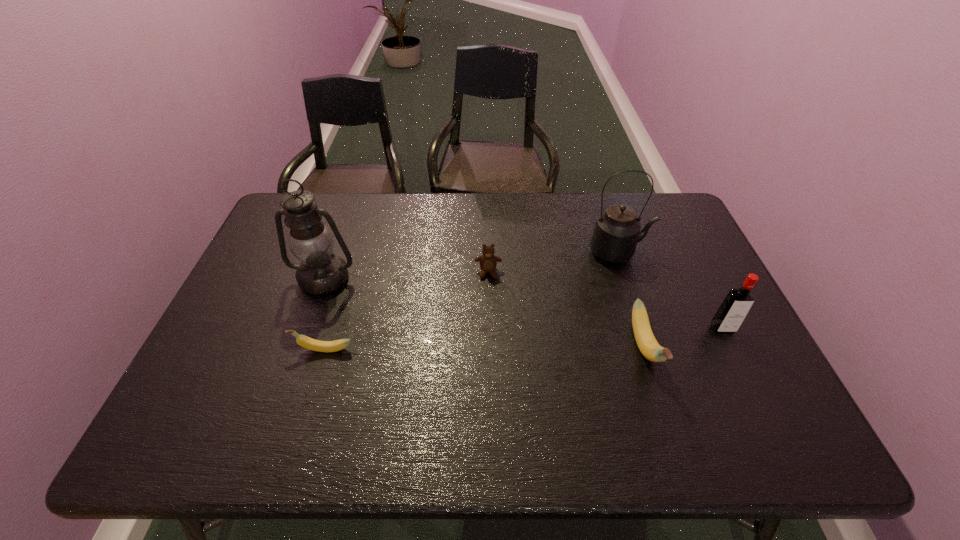
Locate an element on the screen. This screenshot has height=540, width=960. vacant region located at the stem of the left banana is located at coordinates (x=226, y=349).

Find the location of `free space located 0.220m at the stem of the left banana`. free space located 0.220m at the stem of the left banana is located at coordinates (206, 349).

Locate an element on the screen. free spot located at the stem of the right banana is located at coordinates (663, 406).

In order to click on free space located 0.050m on the front of the oil lamp in this screenshot , I will do `click(313, 310)`.

You are a GUI agent. You are given a task and a screenshot of the screen. Output one action in this format:
    pyautogui.click(x=<x>, y=<y>)
    Task: Click on the vacant space located spout on the kettle
    This screenshot has height=540, width=960.
    Given the screenshot: What is the action you would take?
    pyautogui.click(x=699, y=252)

Find the location of a particular element. The image size is (960, 540). vacant space located on the front and back of the vodka is located at coordinates (749, 383).

Find the location of `free point located 0.190m at the face of the teddy bear`. free point located 0.190m at the face of the teddy bear is located at coordinates (490, 332).

Identify the location of object situated at the near edge. This screenshot has height=540, width=960. (649, 347).

The height and width of the screenshot is (540, 960). Find the location of `object that is at the left edge`. object that is at the left edge is located at coordinates (321, 272).

Where is `kettle that is positioned at the right edge`? The width and height of the screenshot is (960, 540). kettle that is positioned at the right edge is located at coordinates coord(617,231).